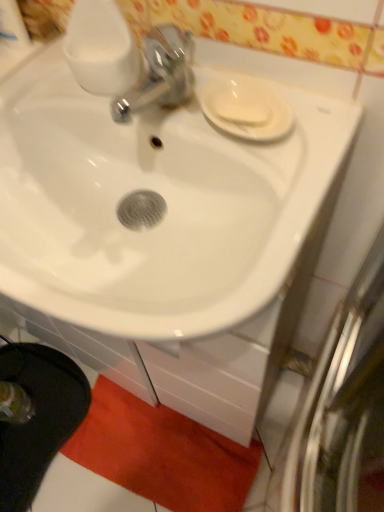
I want to click on free space that is to the left of white matte soap at upper right, so click(x=157, y=109).